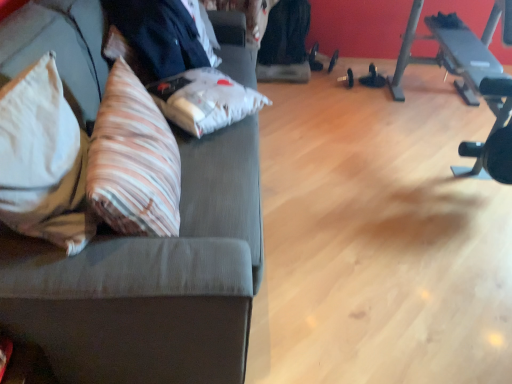
Question: From a real-world perspective, does black rubber barbell at right sit lower than black rubber dumbbell at center?

Choices:
 (A) yes
 (B) no

Answer: (B)

Question: Are black rubber barbell at right and black rubber dumbbell at center far apart?

Choices:
 (A) yes
 (B) no

Answer: (A)

Question: From the image's perspective, would you say black rubber barbell at right is positioned over black rubber dumbbell at center?

Choices:
 (A) yes
 (B) no

Answer: (B)

Question: Is black rubber barbell at right at the right side of black rubber dumbbell at center?

Choices:
 (A) no
 (B) yes

Answer: (B)

Question: Considering the relative sizes of black rubber barbell at right and black rubber dumbbell at center in the image provided, is black rubber barbell at right thinner than black rubber dumbbell at center?

Choices:
 (A) no
 (B) yes

Answer: (B)

Question: Does black rubber barbell at right have a greater width compared to black rubber dumbbell at center?

Choices:
 (A) no
 (B) yes

Answer: (A)

Question: Is black fabric businessman at upper left to the right of black rubber barbell at right from the viewer's perspective?

Choices:
 (A) no
 (B) yes

Answer: (A)

Question: Is black fabric businessman at upper left facing towards black rubber barbell at right?

Choices:
 (A) no
 (B) yes

Answer: (B)

Question: Is black fabric businessman at upper left placed right next to black rubber barbell at right?

Choices:
 (A) no
 (B) yes

Answer: (A)

Question: Does black fabric businessman at upper left appear on the left side of black rubber barbell at right?

Choices:
 (A) no
 (B) yes

Answer: (B)

Question: Considering the relative sizes of black fabric businessman at upper left and black rubber barbell at right in the image provided, is black fabric businessman at upper left wider than black rubber barbell at right?

Choices:
 (A) yes
 (B) no

Answer: (A)

Question: From the image's perspective, would you say black fabric businessman at upper left is shown under black rubber barbell at right?

Choices:
 (A) no
 (B) yes

Answer: (A)

Question: Does black fabric businessman at upper left have a greater height compared to striped fabric throw pillow at left, which is counted as the first throw pillow, starting from the right?

Choices:
 (A) no
 (B) yes

Answer: (A)